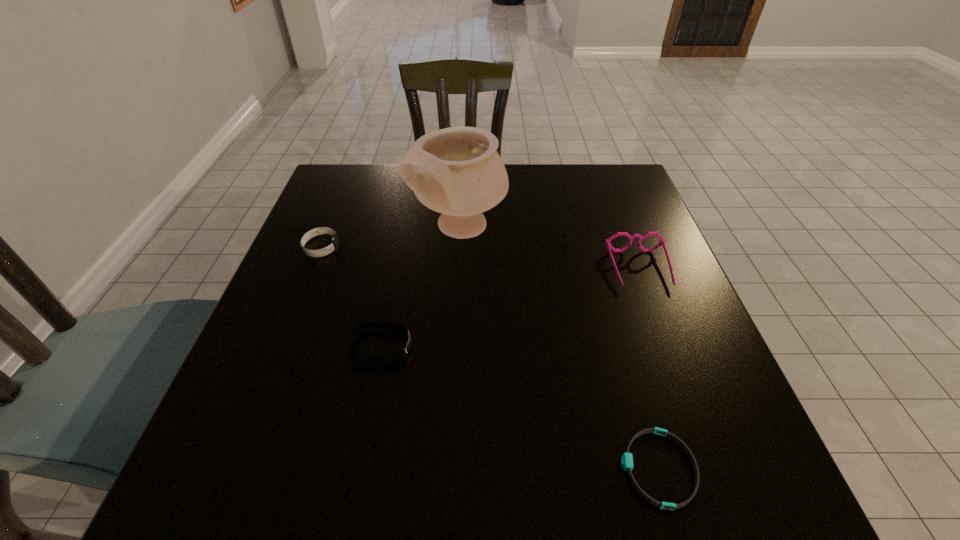
The height and width of the screenshot is (540, 960). Identify the location of the tallest object. (458, 172).

Locate an element on the screen. the second tallest object is located at coordinates (608, 241).

I want to click on the third shortest object, so click(x=333, y=246).

Where is `the leftmost wristband`? The height and width of the screenshot is (540, 960). the leftmost wristband is located at coordinates (333, 246).

Find the location of a particular element. The width and height of the screenshot is (960, 540). the second tallest wristband is located at coordinates (395, 357).

The image size is (960, 540). Identify the location of the second farthest wristband. (395, 357).

Where is `the rightmost wristband`? the rightmost wristband is located at coordinates (627, 460).

Where is `the nearest object`? Image resolution: width=960 pixels, height=540 pixels. the nearest object is located at coordinates (627, 460).

You are a GUI agent. You are given a task and a screenshot of the screen. Output one action in this format:
    pyautogui.click(x=<x>, y=<y>)
    Task: Click on the free space located 0.120m on the front of the pottery
    
    Given the screenshot: What is the action you would take?
    pyautogui.click(x=457, y=306)

Locate an element on the screen. This screenshot has width=960, height=540. vacant space located 0.110m on the arms of the spectacles is located at coordinates (662, 332).